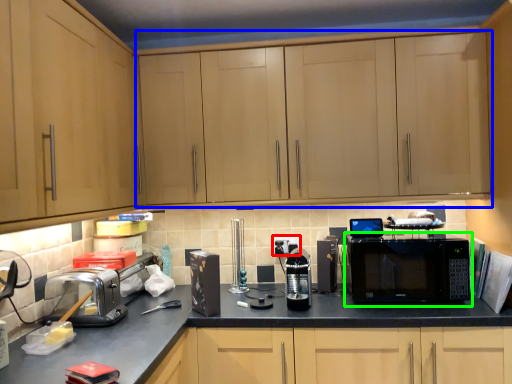
Question: Which is nearer to the electric outlet (highlighted by a red box)? cabinetry (highlighted by a blue box) or microwave oven (highlighted by a green box).

Choices:
 (A) cabinetry
 (B) microwave oven

Answer: (B)